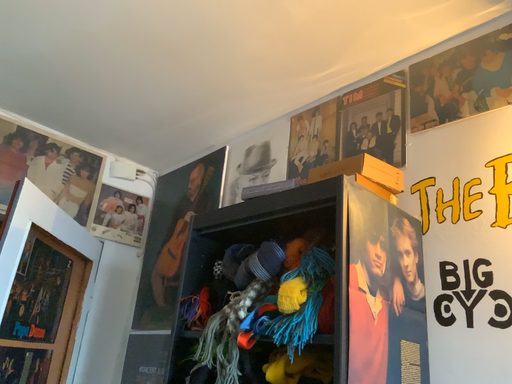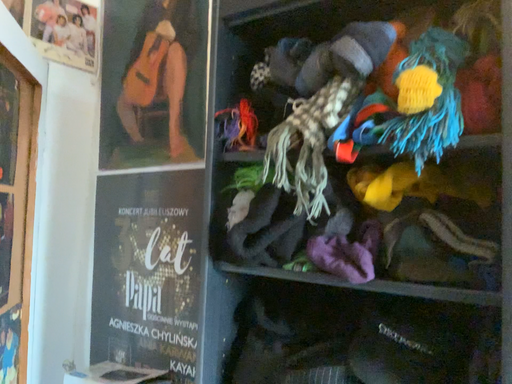
Question: How did the camera likely rotate when shooting the video?

Choices:
 (A) rotated upward
 (B) rotated downward

Answer: (B)